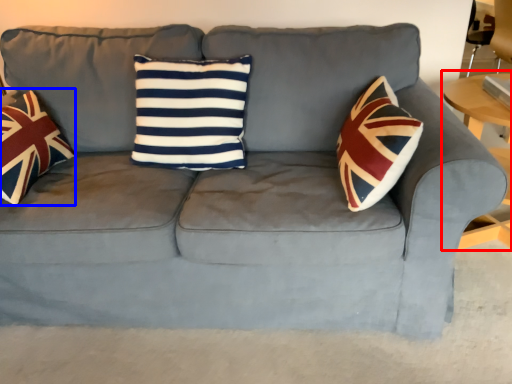
Question: Which of the following is the farthest to the observer, table (highlighted by a red box) or throw pillow (highlighted by a blue box)?

Choices:
 (A) table
 (B) throw pillow

Answer: (A)